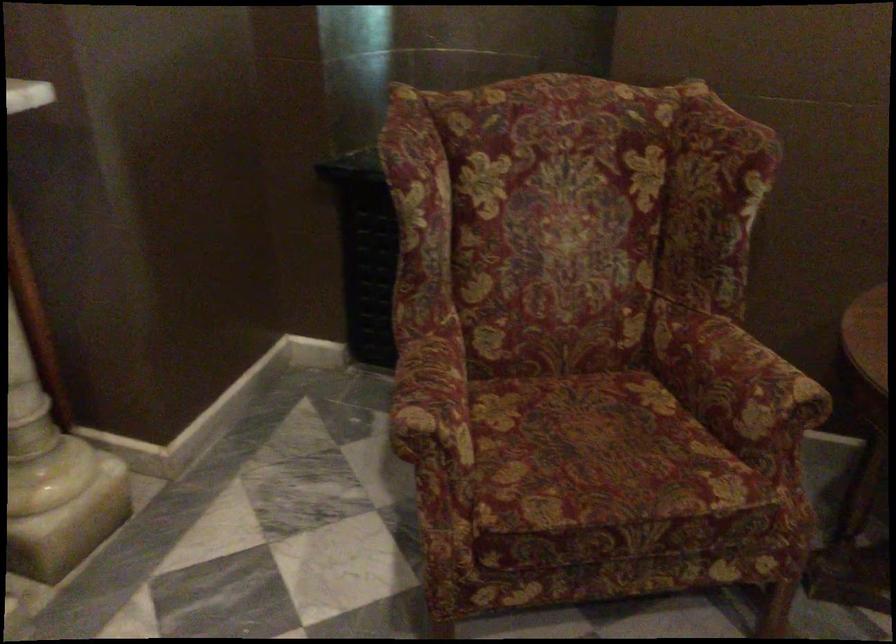
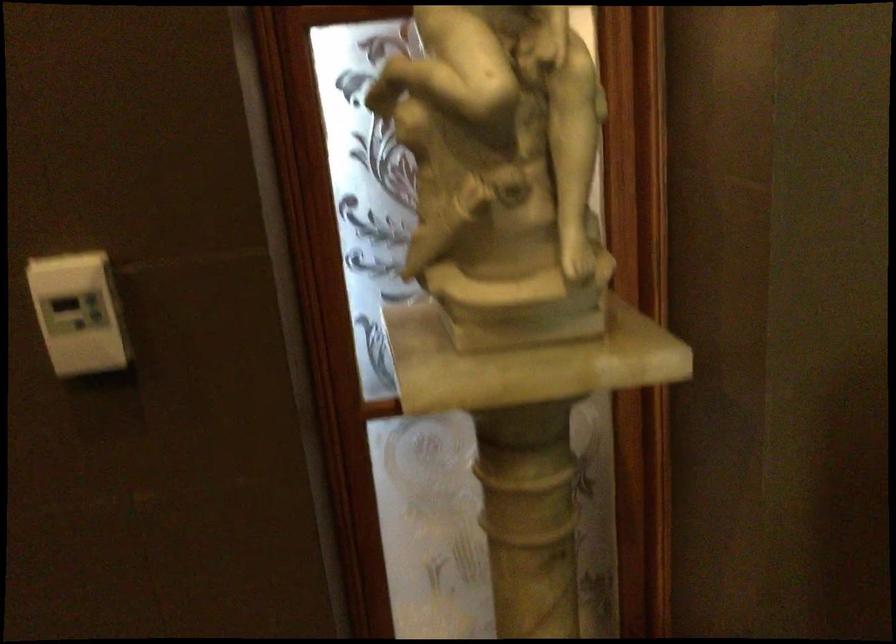
Question: The camera is either moving clockwise (left) or counter-clockwise (right) around the object. The first image is from the beginning of the video and the second image is from the end. Is the camera moving left or right when shooting the video?

Choices:
 (A) Left
 (B) Right

Answer: (B)